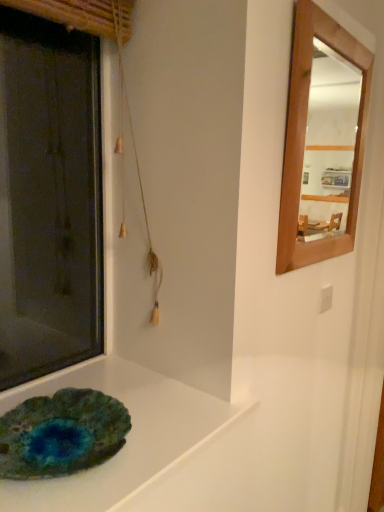
Question: Visually, is matte stone slab at lower left positioned to the left or to the right of teal agate plate at lower left?

Choices:
 (A) right
 (B) left

Answer: (A)

Question: From a real-world perspective, is matte stone slab at lower left physically located above or below teal agate plate at lower left?

Choices:
 (A) below
 (B) above

Answer: (A)

Question: From the image's perspective, is matte stone slab at lower left above or below teal agate plate at lower left?

Choices:
 (A) above
 (B) below

Answer: (B)

Question: Is point (46, 408) positioned closer to the camera than point (3, 498)?

Choices:
 (A) farther
 (B) closer

Answer: (A)

Question: Is teal agate plate at lower left bigger or smaller than matte stone slab at lower left?

Choices:
 (A) small
 (B) big

Answer: (A)

Question: From a real-world perspective, is teal agate plate at lower left above or below matte stone slab at lower left?

Choices:
 (A) above
 (B) below

Answer: (A)

Question: Relative to matte stone slab at lower left, is teal agate plate at lower left in front or behind?

Choices:
 (A) front
 (B) behind

Answer: (B)